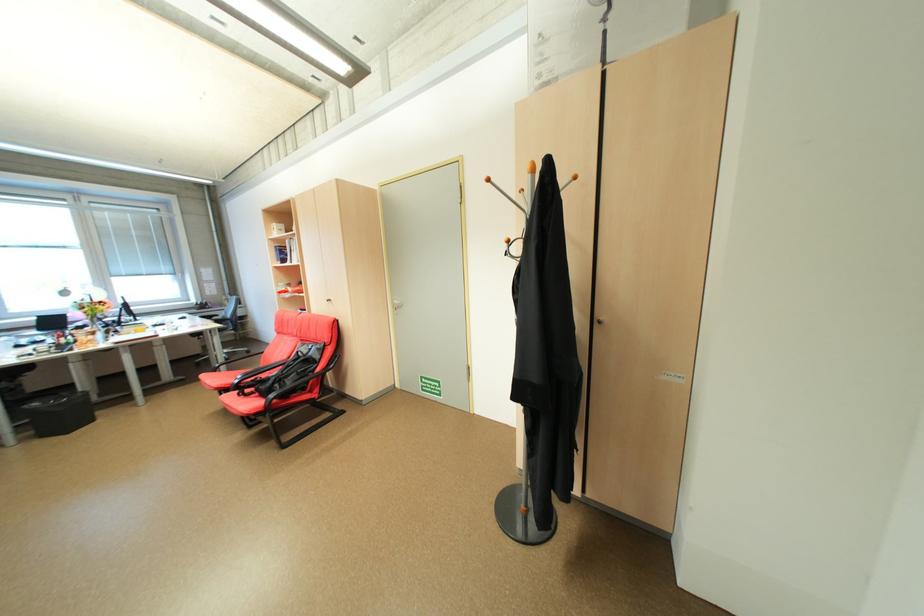
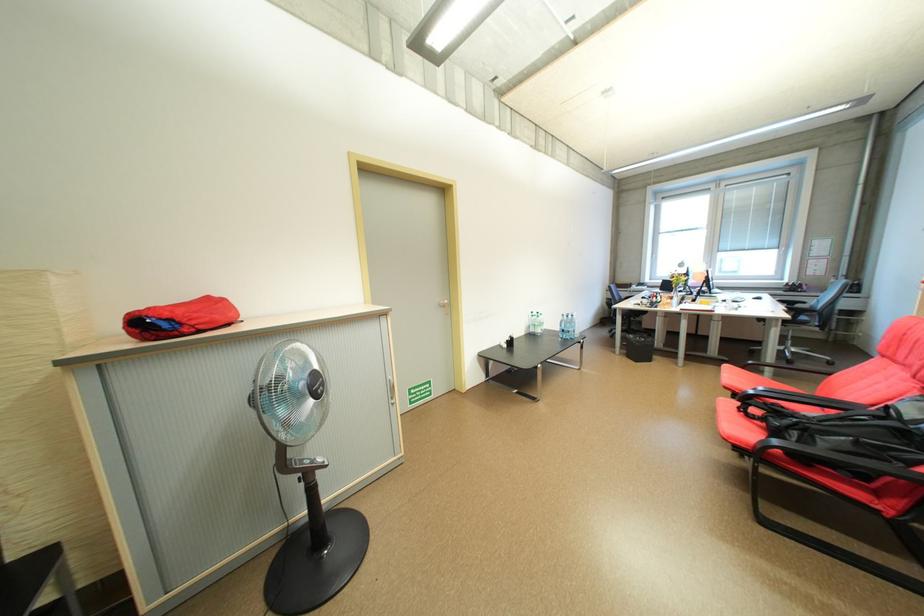
Question: The first image is from the beginning of the video and the second image is from the end. How did the camera likely rotate when shooting the video?

Choices:
 (A) Left
 (B) Right
 (C) Up
 (D) Down

Answer: (A)